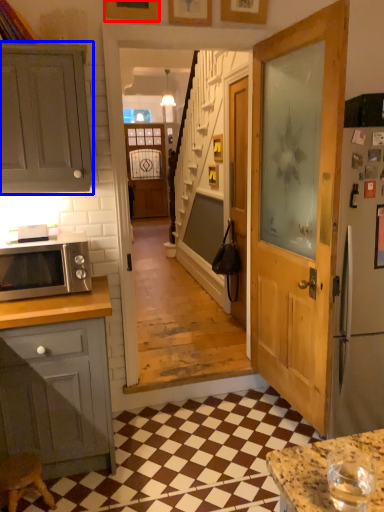
Question: Which object is further to the camera taking this photo, picture frame (highlighted by a red box) or cabinetry (highlighted by a blue box)?

Choices:
 (A) picture frame
 (B) cabinetry

Answer: (A)